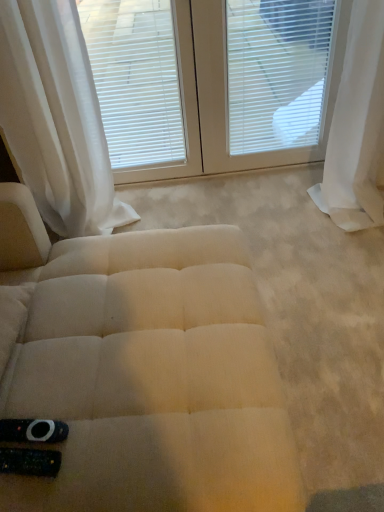
Locate an element on the screen. unoccupied area in front of white plastic blinds at upper center is located at coordinates (275, 204).